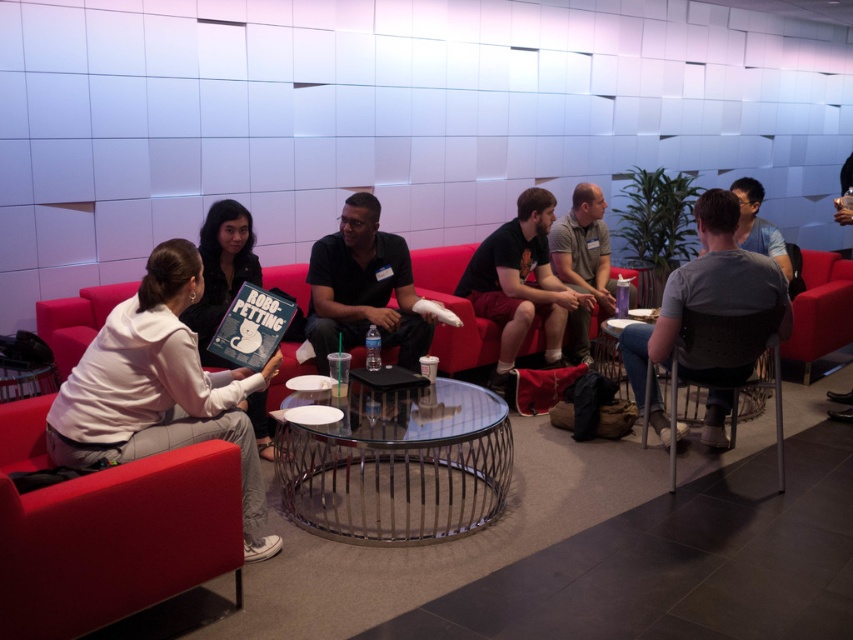
Measure the distance between matte black shirt at center and matte black chair at center.

matte black shirt at center is 5.93 feet away from matte black chair at center.

Identify the location of matte black shirt at center. This screenshot has width=853, height=640. (520, 284).

Can you confirm if gray fabric shirt at right is smaller than black mesh chair at lower right?

Actually, gray fabric shirt at right might be larger than black mesh chair at lower right.

Is gray fabric shirt at right bigger than black mesh chair at lower right?

Correct, gray fabric shirt at right is larger in size than black mesh chair at lower right.

Identify the location of gray fabric shirt at right. This screenshot has width=853, height=640. (706, 289).

Does matte white couch at left appear under gray fabric shirt at center?

Indeed, matte white couch at left is positioned under gray fabric shirt at center.

Is point (352, 362) positioned before point (604, 246)?

Yes.

This screenshot has width=853, height=640. What do you see at coordinates (454, 308) in the screenshot? I see `matte white couch at left` at bounding box center [454, 308].

Locate an element on the screen. The height and width of the screenshot is (640, 853). matte white couch at left is located at coordinates (454, 308).